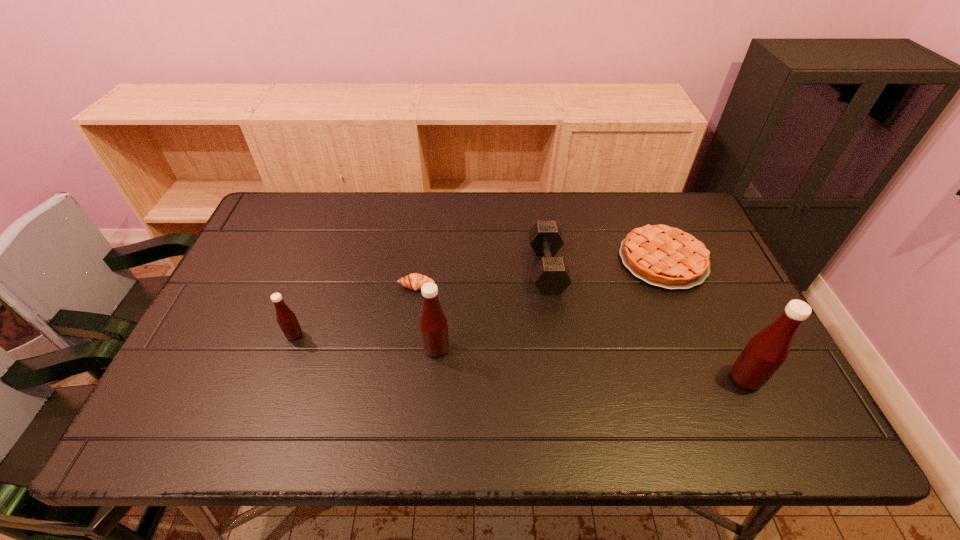
To make them evenly spaced by inserting another Tabasco_sauce among them, please locate a vacant spot for this new Tabasco_sauce. Please provide its 2D coordinates. Your answer should be formatted as a tuple, i.e. [(x, y)], where the tuple contains the x and y coordinates of a point satisfying the conditions above.

[(587, 363)]